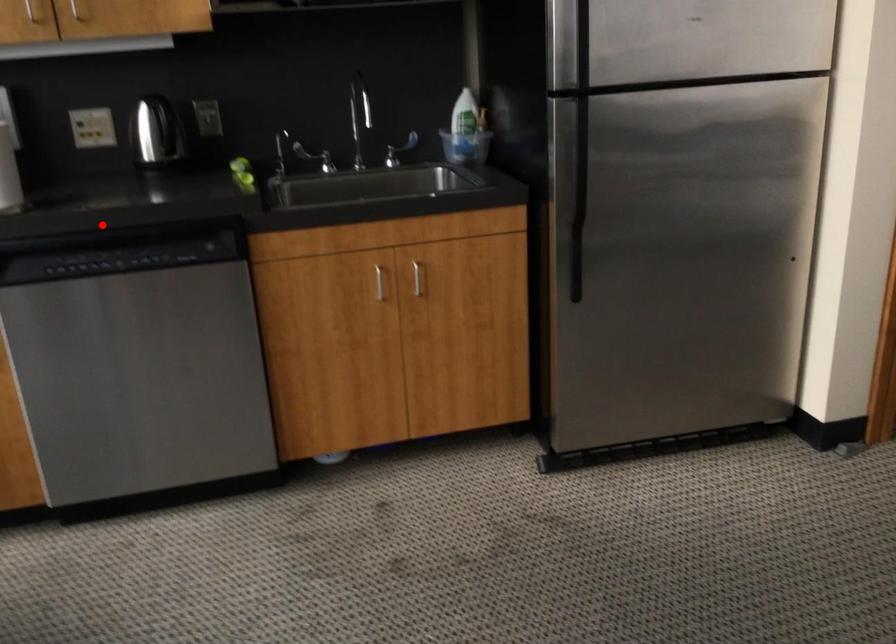
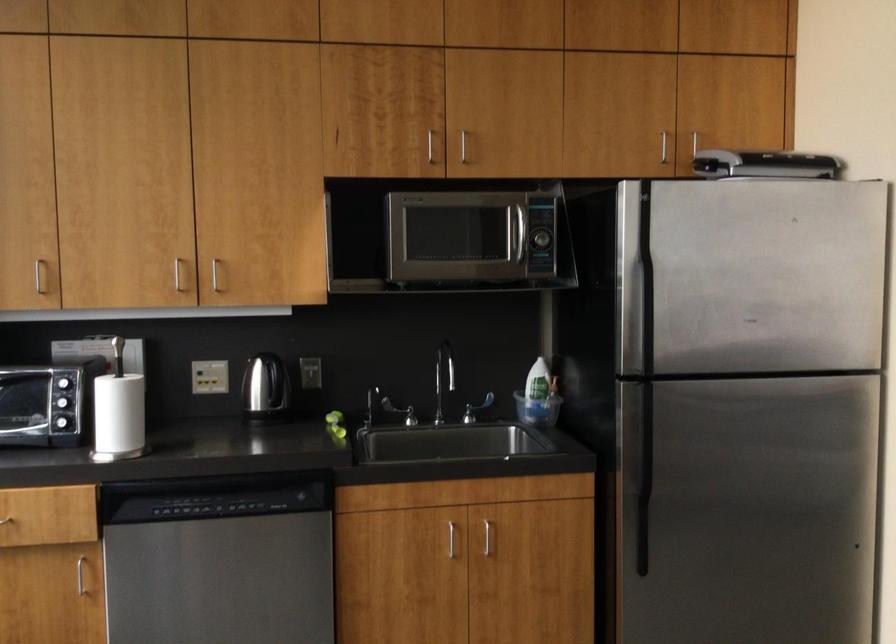
Where in the second image is the point corresponding to the highlighted location from the first image?

(208, 471)